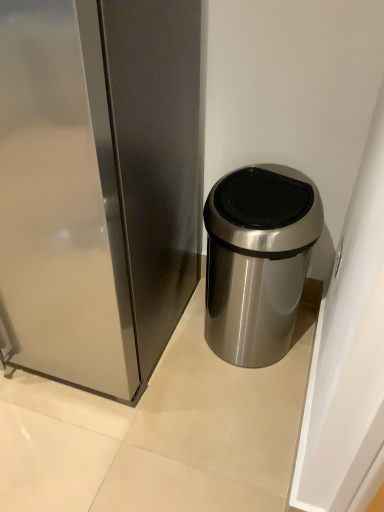
In order to face satin silver trash can at right, should I rotate leftwards or rightwards?

Turn left approximately 19.862 degrees to face it.

Locate an element on the screen. The image size is (384, 512). satin silver trash can at right is located at coordinates (98, 185).

What do you see at coordinates (98, 185) in the screenshot? The width and height of the screenshot is (384, 512). I see `satin silver trash can at right` at bounding box center [98, 185].

The height and width of the screenshot is (512, 384). In order to click on satin silver trash can at center in this screenshot , I will do `click(258, 260)`.

What is the approximate width of satin silver trash can at center?

satin silver trash can at center is 15.71 inches in width.

What do you see at coordinates (258, 260) in the screenshot?
I see `satin silver trash can at center` at bounding box center [258, 260].

The image size is (384, 512). I want to click on satin silver trash can at right, so click(x=98, y=185).

Considering the positions of objects satin silver trash can at center and satin silver trash can at right in the image provided, who is more to the right, satin silver trash can at center or satin silver trash can at right?

From the viewer's perspective, satin silver trash can at center appears more on the right side.

Considering their positions, is satin silver trash can at center located in front of or behind satin silver trash can at right?

satin silver trash can at center is behind satin silver trash can at right.

Considering the positions of point (254, 281) and point (12, 150), is point (254, 281) closer or farther from the camera than point (12, 150)?

Point (254, 281) appears to be farther away from the viewer than point (12, 150).

From the image's perspective, which object appears higher, satin silver trash can at center or satin silver trash can at right?

satin silver trash can at right, from the image's perspective.

From a real-world perspective, is satin silver trash can at center physically located above or below satin silver trash can at right?

In terms of real-world spatial position, satin silver trash can at center is below satin silver trash can at right.

Which of these two, satin silver trash can at center or satin silver trash can at right, is wider?

satin silver trash can at right.

Considering the sizes of objects satin silver trash can at center and satin silver trash can at right in the image provided, who is taller, satin silver trash can at center or satin silver trash can at right?

satin silver trash can at right is taller.

Who is bigger, satin silver trash can at center or satin silver trash can at right?

satin silver trash can at right is bigger.

Is satin silver trash can at center spatially inside satin silver trash can at right, or outside of it?

satin silver trash can at center is outside satin silver trash can at right.

Is satin silver trash can at center next to satin silver trash can at right?

No, satin silver trash can at center is not with satin silver trash can at right.

Does satin silver trash can at center turn towards satin silver trash can at right?

No, satin silver trash can at center is not oriented towards satin silver trash can at right.

How many degrees apart are the facing directions of satin silver trash can at center and satin silver trash can at right?

0.000444 degrees.

How distant is satin silver trash can at center from satin silver trash can at right?

They are 15.35 inches apart.

Locate an element on the screen. The height and width of the screenshot is (512, 384). waste container directly beneath the satin silver trash can at right (from a real-world perspective) is located at coordinates (258, 260).

Can you confirm if satin silver trash can at right is positioned to the left of satin silver trash can at center?

Yes, satin silver trash can at right is to the left of satin silver trash can at center.

Is satin silver trash can at right further to the viewer compared to satin silver trash can at center?

No, satin silver trash can at right is in front of satin silver trash can at center.

Which is closer to the camera, (198, 198) or (269, 270)?

Point (198, 198) is positioned farther from the camera compared to point (269, 270).

From the image's perspective, is satin silver trash can at right positioned above or below satin silver trash can at center?

satin silver trash can at right is situated higher than satin silver trash can at center in the image.

From a real-world perspective, who is located lower, satin silver trash can at right or satin silver trash can at center?

satin silver trash can at center.

Considering the relative sizes of satin silver trash can at right and satin silver trash can at center in the image provided, is satin silver trash can at right wider than satin silver trash can at center?

Yes.

Considering the sizes of objects satin silver trash can at right and satin silver trash can at center in the image provided, who is shorter, satin silver trash can at right or satin silver trash can at center?

With less height is satin silver trash can at center.

Considering the sizes of objects satin silver trash can at right and satin silver trash can at center in the image provided, who is smaller, satin silver trash can at right or satin silver trash can at center?

satin silver trash can at center is smaller.

Can we say satin silver trash can at right lies outside satin silver trash can at center?

Yes, satin silver trash can at right is located beyond the bounds of satin silver trash can at center.

Based on the photo, is satin silver trash can at right beside satin silver trash can at center?

satin silver trash can at right and satin silver trash can at center are clearly separated.

Could you tell me if satin silver trash can at right is turned towards satin silver trash can at center?

No, satin silver trash can at right does not turn towards satin silver trash can at center.

How many degrees apart are the facing directions of satin silver trash can at right and satin silver trash can at center?

The facing directions of satin silver trash can at right and satin silver trash can at center are 0.000444 degrees apart.

Image resolution: width=384 pixels, height=512 pixels. Find the location of `appliance on the left of satin silver trash can at center`. appliance on the left of satin silver trash can at center is located at coordinates (98, 185).

This screenshot has width=384, height=512. Identify the location of appliance above the satin silver trash can at center (from a real-world perspective). (98, 185).

At what (x,y) coordinates should I click in order to perform the action: click on appliance that is in front of the satin silver trash can at center. Please return your answer as a coordinate pair (x, y). This screenshot has height=512, width=384. Looking at the image, I should click on (98, 185).